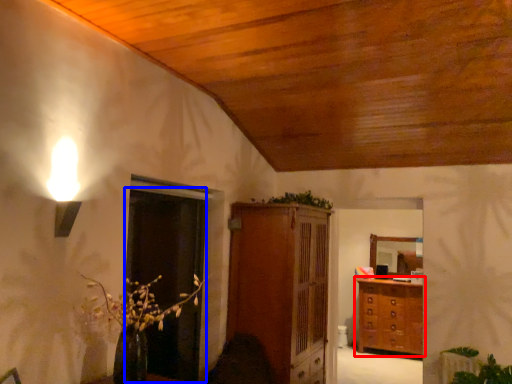
Question: Which point is further to the camera, chest of drawers (highlighted by a red box) or glass door (highlighted by a blue box)?

Choices:
 (A) chest of drawers
 (B) glass door

Answer: (A)